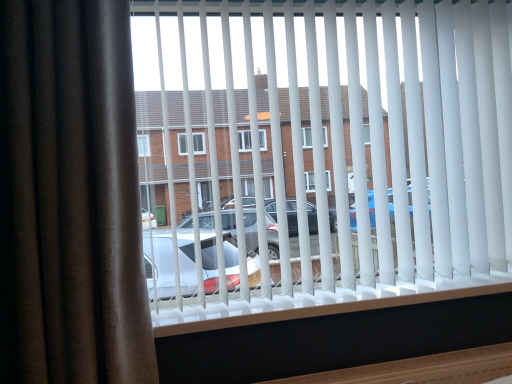
Question: Considering the positions of point (10, 185) and point (207, 177), is point (10, 185) closer or farther from the camera than point (207, 177)?

Choices:
 (A) closer
 (B) farther

Answer: (A)

Question: From a real-world perspective, is brown velvet curtain at left positioned above or below white plastic blinds at center?

Choices:
 (A) below
 (B) above

Answer: (A)

Question: Considering the positions of brown velvet curtain at left and white plastic blinds at center in the image, is brown velvet curtain at left taller or shorter than white plastic blinds at center?

Choices:
 (A) short
 (B) tall

Answer: (B)

Question: Considering the positions of white plastic blinds at center and brown velvet curtain at left in the image, is white plastic blinds at center wider or thinner than brown velvet curtain at left?

Choices:
 (A) thin
 (B) wide

Answer: (A)

Question: Is white plastic blinds at center spatially inside brown velvet curtain at left, or outside of it?

Choices:
 (A) inside
 (B) outside

Answer: (B)

Question: Considering the positions of point (192, 148) and point (30, 231), is point (192, 148) closer or farther from the camera than point (30, 231)?

Choices:
 (A) closer
 (B) farther

Answer: (B)

Question: From a real-world perspective, is white plastic blinds at center physically located above or below brown velvet curtain at left?

Choices:
 (A) above
 (B) below

Answer: (A)